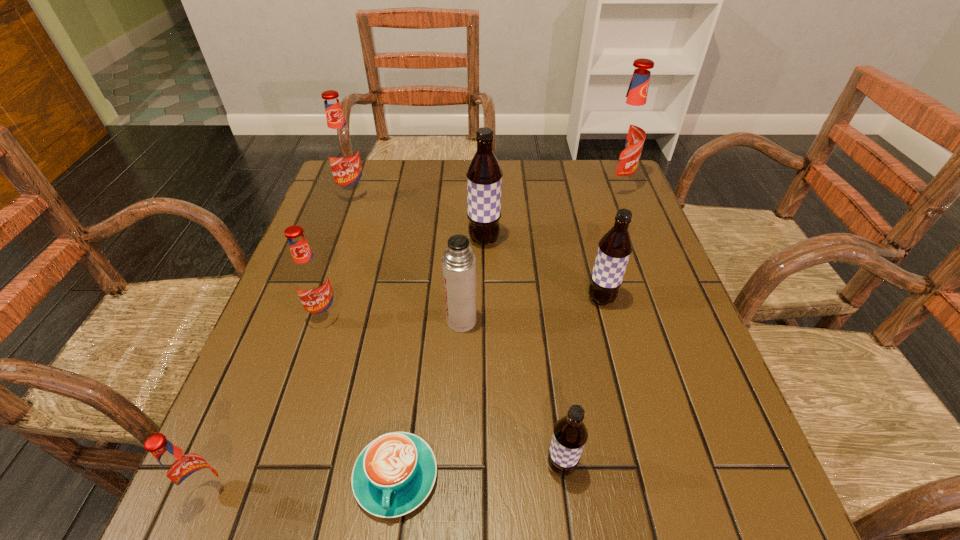
The width and height of the screenshot is (960, 540). In order to click on free space located on the right of the nearest brown root beer in this screenshot , I will do `click(740, 466)`.

The width and height of the screenshot is (960, 540). Identify the location of free spot located on the back of the nearest red root beer. [x=268, y=354].

The width and height of the screenshot is (960, 540). Find the location of `cappuccino positioned at the near edge`. cappuccino positioned at the near edge is located at coordinates (393, 475).

The image size is (960, 540). Identify the location of object at the far left corner. (342, 149).

I want to click on object present at the near left corner, so click(187, 472).

The height and width of the screenshot is (540, 960). I want to click on object at the far right corner, so click(x=627, y=131).

In the image, there is a desktop. Identify the location of free region at the far edge. (514, 160).

Where is `vacant space at the near edge of the desktop`? This screenshot has height=540, width=960. vacant space at the near edge of the desktop is located at coordinates (413, 514).

Find the location of a particular element. The image size is (960, 540). vacant space at the left edge of the desktop is located at coordinates (308, 440).

Where is `free space at the right edge`? The width and height of the screenshot is (960, 540). free space at the right edge is located at coordinates (691, 346).